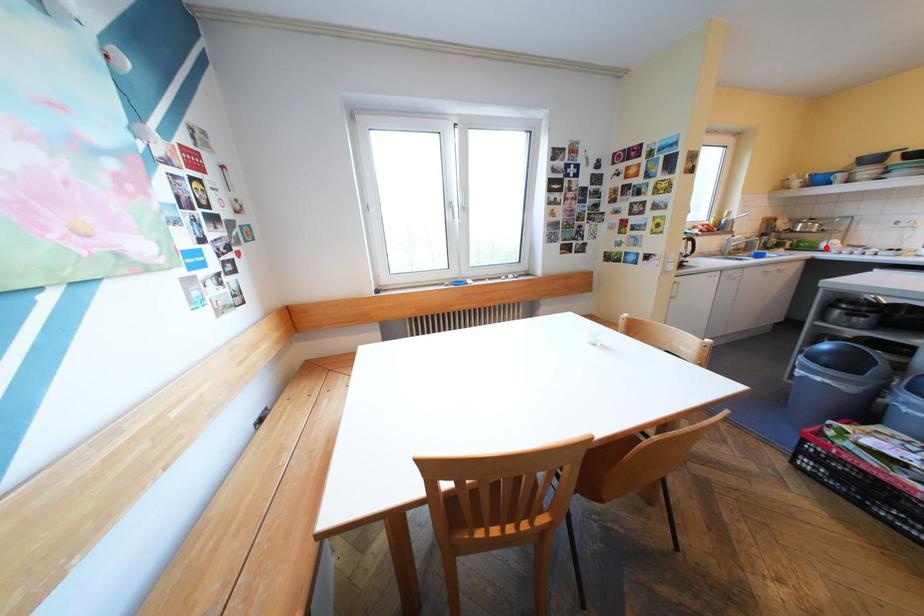
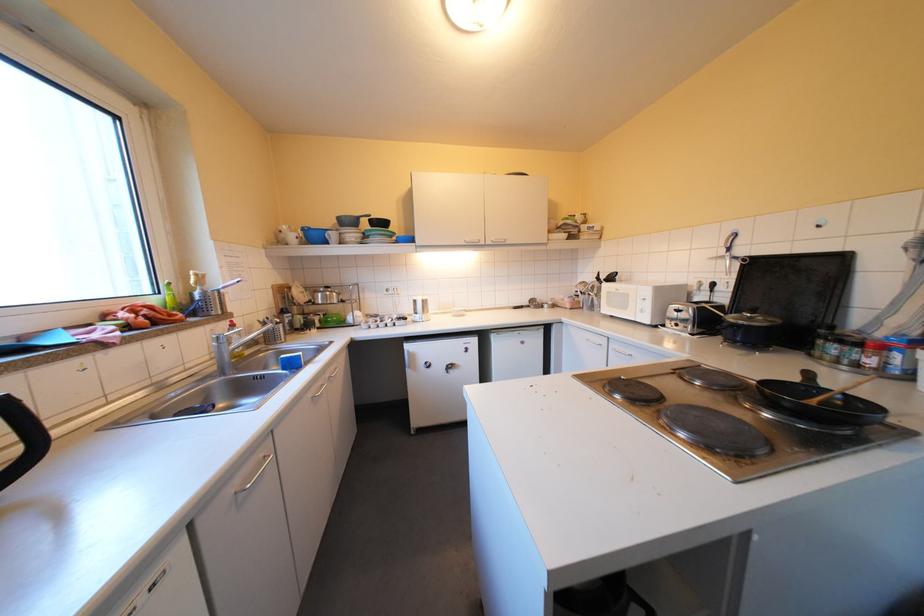
Find the pixel in the second image that matches the highlighted location in the first image.

(356, 323)